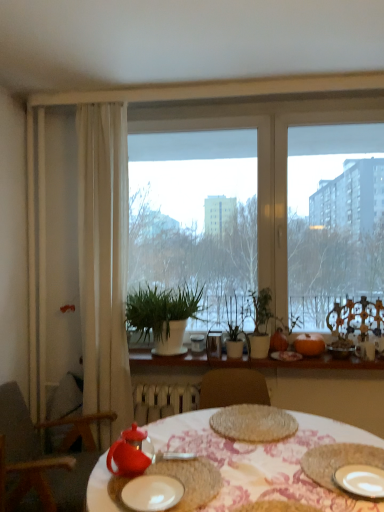
Where is `vacant space in between woven mat at center and matte red teapot at lower center, the 4th tableware from the right`? This screenshot has height=512, width=384. vacant space in between woven mat at center and matte red teapot at lower center, the 4th tableware from the right is located at coordinates (203, 448).